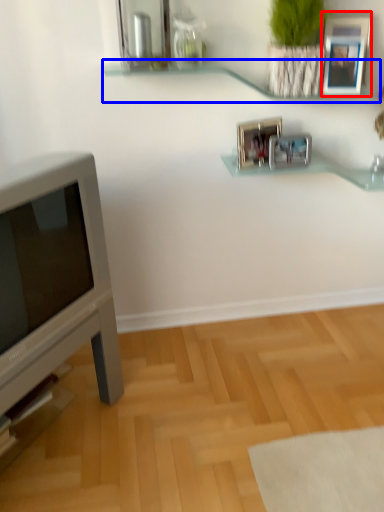
Question: Which object is further to the camera taking this photo, picture frame (highlighted by a red box) or shelf (highlighted by a blue box)?

Choices:
 (A) picture frame
 (B) shelf

Answer: (A)